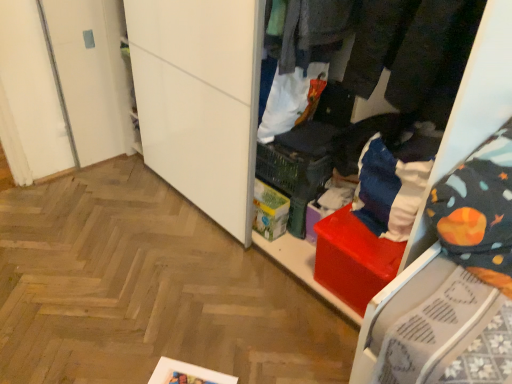
Question: Is black fabric pants at upper right, acting as the 4th clothing starting from the back, aimed at dark gray fabric pants at center, acting as the second clothing starting from the front?

Choices:
 (A) yes
 (B) no

Answer: (A)

Question: Is black fabric pants at upper right, acting as the 4th clothing starting from the back, smaller than dark gray fabric pants at center, arranged as the third clothing when viewed from the back?

Choices:
 (A) yes
 (B) no

Answer: (A)

Question: Would you consider black fabric pants at upper right, acting as the 4th clothing starting from the back, to be distant from dark gray fabric pants at center, arranged as the third clothing when viewed from the back?

Choices:
 (A) no
 (B) yes

Answer: (A)

Question: Is dark gray fabric pants at center, acting as the second clothing starting from the front, inside black fabric pants at upper right, acting as the 4th clothing starting from the back?

Choices:
 (A) yes
 (B) no

Answer: (A)

Question: Considering the relative sizes of black fabric pants at upper right, the 1th clothing positioned from the front, and dark gray fabric pants at center, acting as the second clothing starting from the front, in the image provided, is black fabric pants at upper right, the 1th clothing positioned from the front, wider than dark gray fabric pants at center, acting as the second clothing starting from the front,?

Choices:
 (A) yes
 (B) no

Answer: (A)

Question: From the image's perspective, is dark gray fabric pants at upper center, marked as the 2th clothing in a back-to-front arrangement, above or below dark gray fabric pants at center, arranged as the third clothing when viewed from the back?

Choices:
 (A) above
 (B) below

Answer: (A)

Question: Is dark gray fabric pants at upper center, marked as the 2th clothing in a back-to-front arrangement, to the left or to the right of dark gray fabric pants at center, arranged as the third clothing when viewed from the back, in the image?

Choices:
 (A) right
 (B) left

Answer: (B)

Question: In terms of width, does dark gray fabric pants at upper center, which appears as the 3th clothing when viewed from the front, look wider or thinner when compared to dark gray fabric pants at center, acting as the second clothing starting from the front?

Choices:
 (A) thin
 (B) wide

Answer: (A)

Question: Considering the positions of point (322, 56) and point (403, 112), is point (322, 56) closer or farther from the camera than point (403, 112)?

Choices:
 (A) closer
 (B) farther

Answer: (B)

Question: Considering the positions of black fabric pants at upper right, acting as the 4th clothing starting from the back, and dark gray fabric pants at center, arranged as the third clothing when viewed from the back, in the image, is black fabric pants at upper right, acting as the 4th clothing starting from the back, bigger or smaller than dark gray fabric pants at center, arranged as the third clothing when viewed from the back,?

Choices:
 (A) big
 (B) small

Answer: (B)

Question: In the image, is black fabric pants at upper right, the 1th clothing positioned from the front, on the left side or the right side of dark gray fabric pants at center, acting as the second clothing starting from the front?

Choices:
 (A) left
 (B) right

Answer: (B)

Question: Considering the positions of point (461, 23) and point (404, 54), is point (461, 23) closer or farther from the camera than point (404, 54)?

Choices:
 (A) farther
 (B) closer

Answer: (B)

Question: Considering the positions of black fabric pants at upper right, acting as the 4th clothing starting from the back, and dark gray fabric pants at center, arranged as the third clothing when viewed from the back, in the image, is black fabric pants at upper right, acting as the 4th clothing starting from the back, taller or shorter than dark gray fabric pants at center, arranged as the third clothing when viewed from the back,?

Choices:
 (A) short
 (B) tall

Answer: (A)

Question: Visually, is white fabric bag at center, positioned as the first clothing in back-to-front order, positioned to the left or to the right of dark gray fabric pants at upper center, marked as the 2th clothing in a back-to-front arrangement?

Choices:
 (A) right
 (B) left

Answer: (B)

Question: From the image's perspective, relative to dark gray fabric pants at upper center, marked as the 2th clothing in a back-to-front arrangement, is white fabric bag at center, positioned as the first clothing in back-to-front order, above or below?

Choices:
 (A) below
 (B) above

Answer: (A)